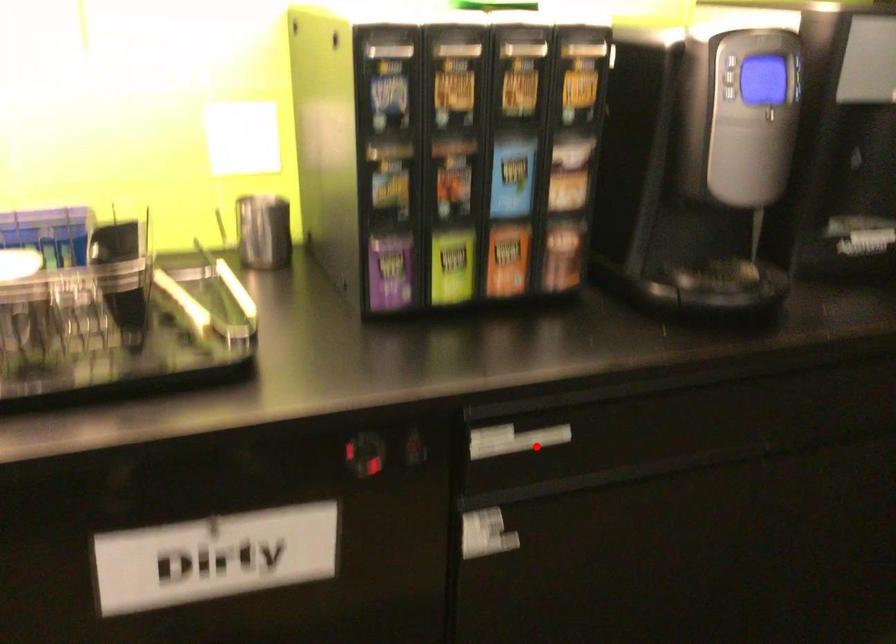
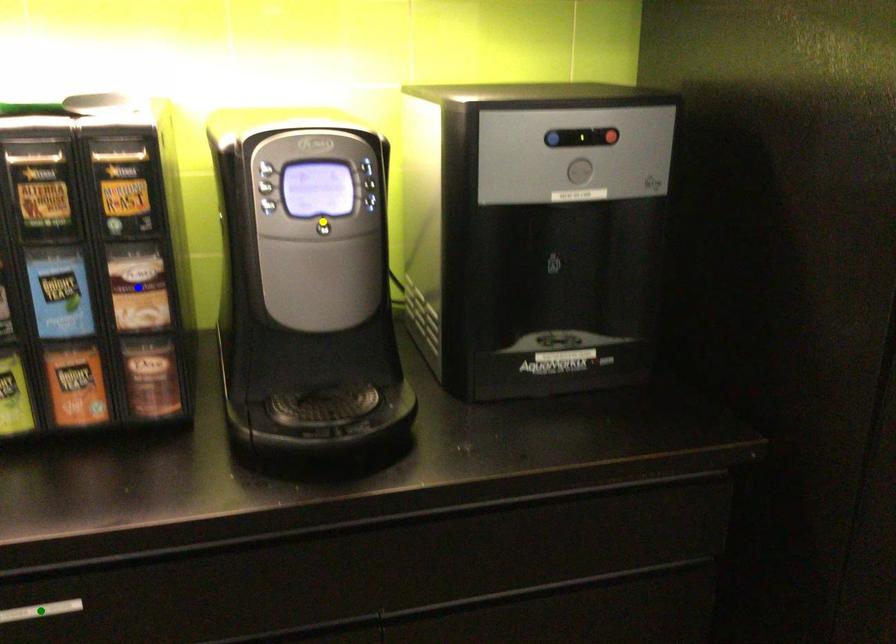
Question: I am providing you with two images of the same scene from different viewpoints. A red point is marked on the first image. You are given multiple points on the second image. Which point in image 2 is actually the same real-world point as the red point in image 1?

Choices:
 (A) green point
 (B) yellow point
 (C) blue point

Answer: (A)